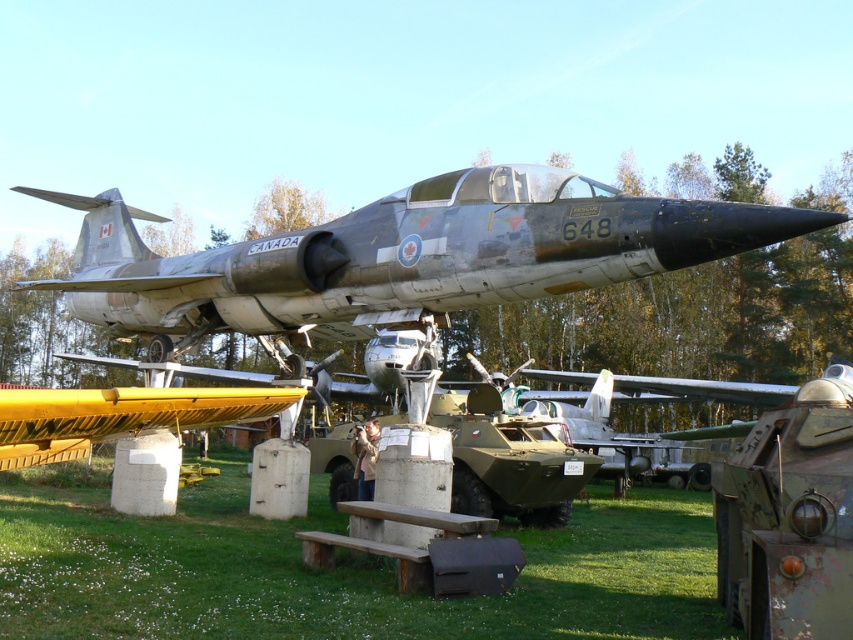
Between point (219, 536) and point (175, 316), which one is positioned behind?

The point (175, 316) is behind.

Can you confirm if green grass at center is thinner than camouflage paint fighter jet at center?

Correct, green grass at center's width is less than camouflage paint fighter jet at center's.

Is point (607, 561) positioned before point (351, 228)?

No.

At what (x,y) coordinates should I click in order to perform the action: click on green grass at center. Please return your answer as a coordinate pair (x, y). This screenshot has width=853, height=640. Looking at the image, I should click on (332, 570).